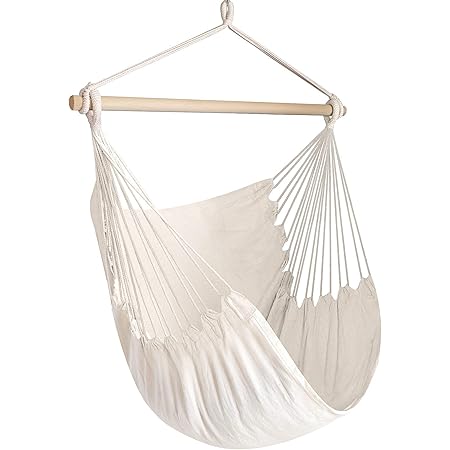
This screenshot has width=450, height=450. What are the coordinates of `left end of wooden rod` in the screenshot? It's located at (72, 103).